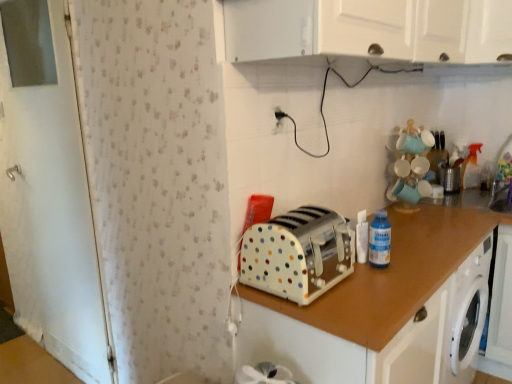
Question: From a real-world perspective, is white plastic electric outlet at upper center under white polka dot toaster at center, which is the second cabinetry from top to bottom?

Choices:
 (A) yes
 (B) no

Answer: (B)

Question: Is white polka dot toaster at center, which appears as the first cabinetry when ordered from the bottom, completely or partially inside white plastic electric outlet at upper center?

Choices:
 (A) yes
 (B) no

Answer: (B)

Question: Is white plastic electric outlet at upper center positioned far away from white polka dot toaster at center, which appears as the first cabinetry when ordered from the bottom?

Choices:
 (A) no
 (B) yes

Answer: (A)

Question: Is white plastic electric outlet at upper center further to camera compared to white polka dot toaster at center, which is the second cabinetry from top to bottom?

Choices:
 (A) yes
 (B) no

Answer: (A)

Question: Considering the relative sizes of white plastic electric outlet at upper center and white polka dot toaster at center, which is the second cabinetry from top to bottom, in the image provided, is white plastic electric outlet at upper center smaller than white polka dot toaster at center, which is the second cabinetry from top to bottom,?

Choices:
 (A) no
 (B) yes

Answer: (B)

Question: Could you tell me if white plastic electric outlet at upper center is turned towards white polka dot toaster at center, which appears as the first cabinetry when ordered from the bottom?

Choices:
 (A) no
 (B) yes

Answer: (A)

Question: From a real-world perspective, is white polka dot plastic toaster at center on top of white polka dot toaster at center, which is the second cabinetry from top to bottom?

Choices:
 (A) no
 (B) yes

Answer: (B)

Question: Can you confirm if white polka dot plastic toaster at center is shorter than white polka dot toaster at center, which appears as the first cabinetry when ordered from the bottom?

Choices:
 (A) yes
 (B) no

Answer: (A)

Question: Is white polka dot plastic toaster at center positioned beyond the bounds of white polka dot toaster at center, which is the second cabinetry from top to bottom?

Choices:
 (A) yes
 (B) no

Answer: (A)

Question: Does white polka dot plastic toaster at center appear on the left side of white polka dot toaster at center, which appears as the first cabinetry when ordered from the bottom?

Choices:
 (A) yes
 (B) no

Answer: (A)

Question: From the image's perspective, is white polka dot plastic toaster at center under white polka dot toaster at center, which is the second cabinetry from top to bottom?

Choices:
 (A) yes
 (B) no

Answer: (B)

Question: Can you confirm if white polka dot plastic toaster at center is wider than white polka dot toaster at center, which is the second cabinetry from top to bottom?

Choices:
 (A) no
 (B) yes

Answer: (A)

Question: Is metallic silver toaster at upper right taller than white plastic electric outlet at upper center?

Choices:
 (A) yes
 (B) no

Answer: (A)